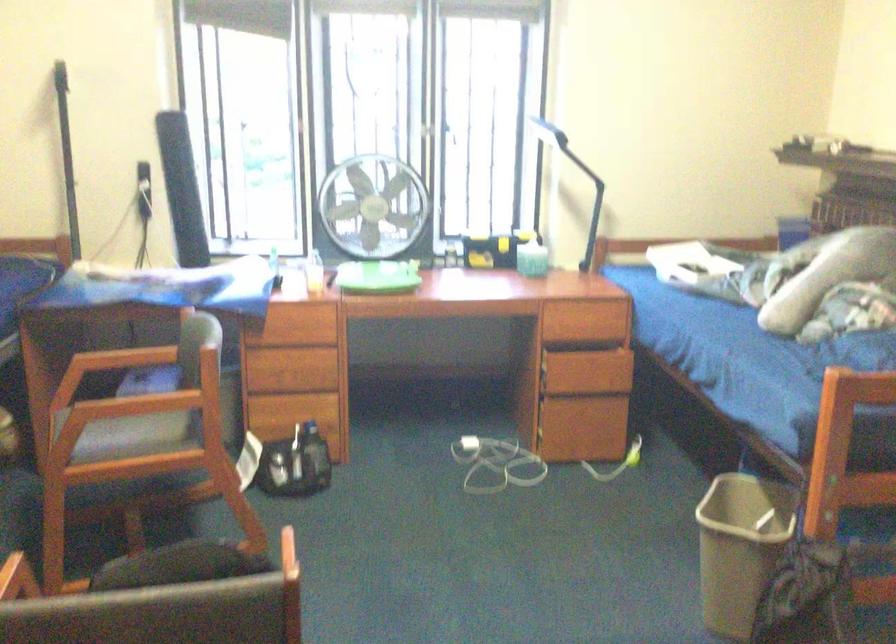
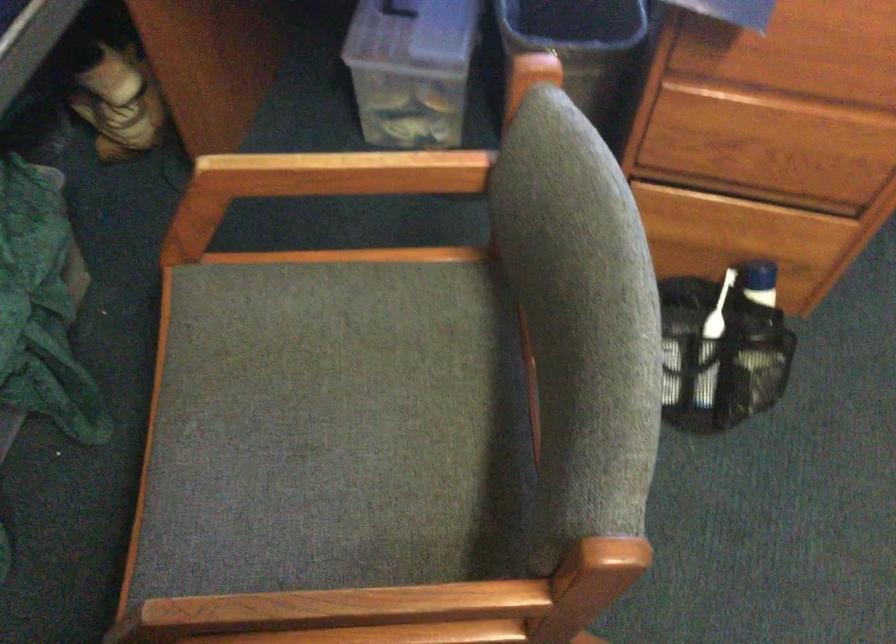
The point at (288, 373) is marked in the first image. Where is the corresponding point in the second image?

(751, 147)